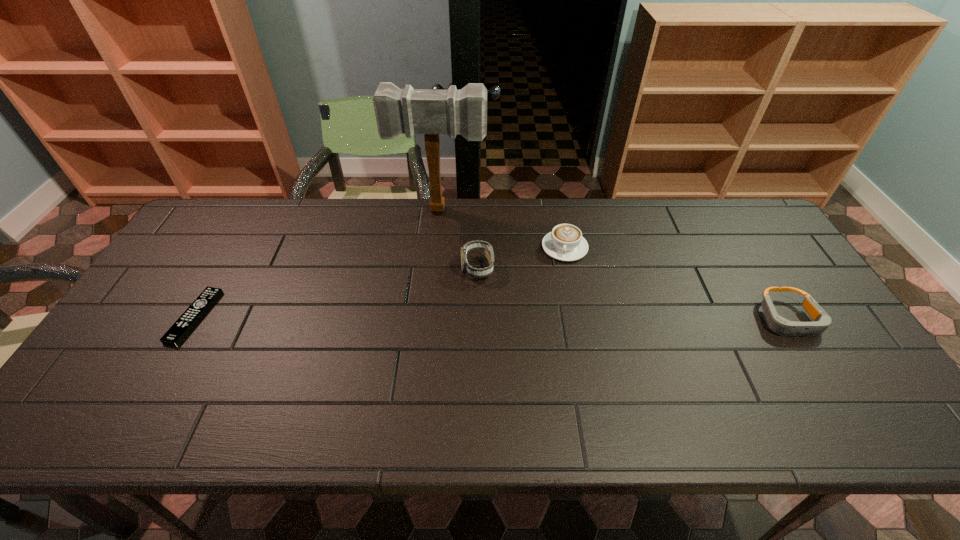
At what (x,y) coordinates should I click in order to perform the action: click on free space between the fourth object from left to right and the leftmost object. Please return your answer as a coordinate pair (x, y). Looking at the image, I should click on (379, 282).

Locate an element on the screen. The height and width of the screenshot is (540, 960). vacant area that lies between the third tallest object and the goggles is located at coordinates (677, 283).

Where is `free area in between the remote control and the second tallest object`? free area in between the remote control and the second tallest object is located at coordinates (336, 292).

The width and height of the screenshot is (960, 540). Find the location of `free space between the second tallest object and the cappuccino`. free space between the second tallest object and the cappuccino is located at coordinates (521, 258).

Find the location of `free space between the third tallest object and the watch`. free space between the third tallest object and the watch is located at coordinates (521, 258).

This screenshot has width=960, height=540. Find the location of `vacant region between the shortest object and the watch`. vacant region between the shortest object and the watch is located at coordinates (336, 292).

The width and height of the screenshot is (960, 540). Find the location of `vacant point located between the farthest object and the remote control`. vacant point located between the farthest object and the remote control is located at coordinates (318, 264).

Identify the location of unoccupied position between the second object from right to left and the second tallest object. click(x=521, y=258).

This screenshot has height=540, width=960. Identify the location of free area in between the farthest object and the rightmost object. (614, 265).

Identify the location of object identified as the third closest to the fourth shortest object. (188, 320).